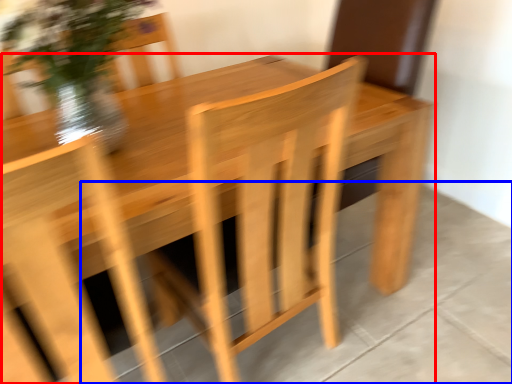
Question: Among these objects, which one is nearest to the camera, table (highlighted by a red box) or concrete (highlighted by a blue box)?

Choices:
 (A) table
 (B) concrete

Answer: (A)